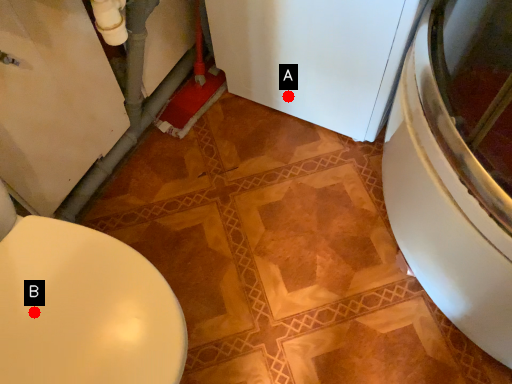
Question: Two points are circled on the image, labeled by A and B beside each circle. Which point appears farthest from the camera in this image?

Choices:
 (A) A is further
 (B) B is further

Answer: (A)